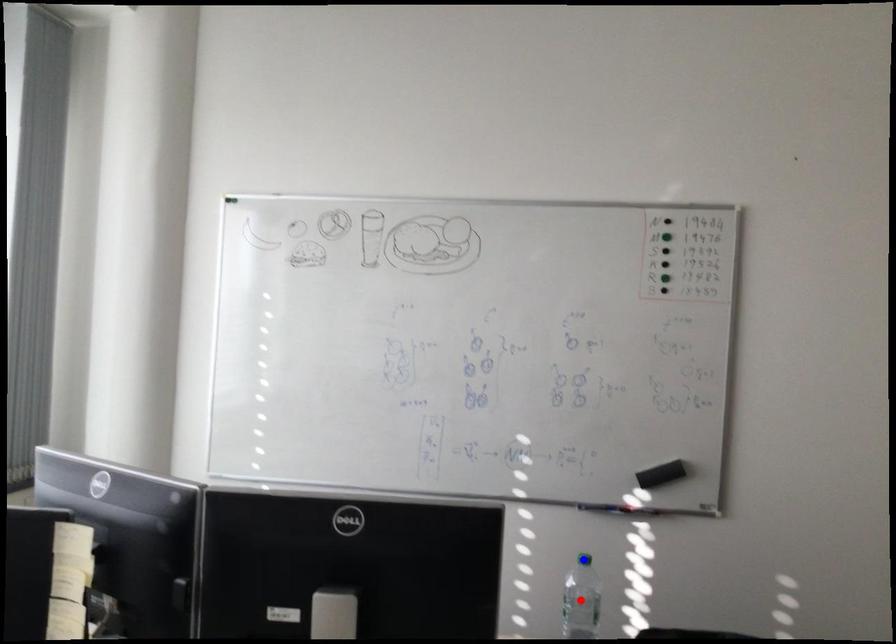
Question: In the image, two points are highlighted. Which point is nearer to the camera? Reply with the corresponding letter.

Choices:
 (A) blue point
 (B) red point

Answer: (B)